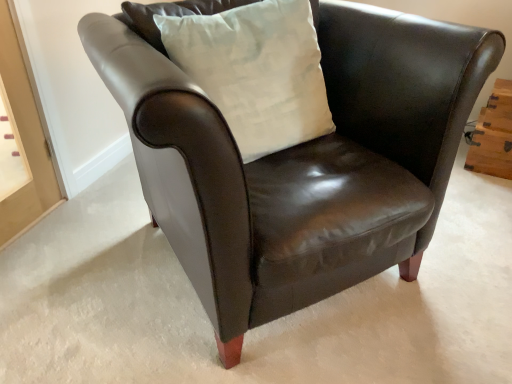
Image resolution: width=512 pixels, height=384 pixels. Identify the location of white cotton pillow at upper center. (256, 71).

What is the approximate height of white cotton pillow at upper center?

white cotton pillow at upper center is 19.49 inches in height.

The image size is (512, 384). Describe the element at coordinates (256, 71) in the screenshot. I see `white cotton pillow at upper center` at that location.

The height and width of the screenshot is (384, 512). Describe the element at coordinates (493, 135) in the screenshot. I see `wooden drawer at right` at that location.

What is the approximate height of wooden drawer at right?

wooden drawer at right is 24.56 centimeters tall.

Identify the location of wooden drawer at right. The width and height of the screenshot is (512, 384). (493, 135).

Identify the location of white cotton pillow at upper center. (256, 71).

Does wooden drawer at right appear on the left side of white cotton pillow at upper center?

No, wooden drawer at right is not to the left of white cotton pillow at upper center.

Which object is closer to the camera taking this photo, wooden drawer at right or white cotton pillow at upper center?

white cotton pillow at upper center is in front.

Which is less distant, [493,158] or [267,125]?

Point [493,158] is positioned farther from the camera compared to point [267,125].

From the image's perspective, is wooden drawer at right positioned above or below white cotton pillow at upper center?

wooden drawer at right is situated lower than white cotton pillow at upper center in the image.

From a real-world perspective, which is physically below, wooden drawer at right or white cotton pillow at upper center?

In real-world perspective, wooden drawer at right is lower.

Which of these two, wooden drawer at right or white cotton pillow at upper center, is wider?

white cotton pillow at upper center.

Does wooden drawer at right have a lesser height compared to white cotton pillow at upper center?

Yes, wooden drawer at right is shorter than white cotton pillow at upper center.

Can you confirm if wooden drawer at right is bigger than white cotton pillow at upper center?

Actually, wooden drawer at right might be smaller than white cotton pillow at upper center.

Is wooden drawer at right not inside white cotton pillow at upper center?

Absolutely, wooden drawer at right is external to white cotton pillow at upper center.

Are wooden drawer at right and white cotton pillow at upper center located far from each other?

Indeed, wooden drawer at right is not near white cotton pillow at upper center.

Is wooden drawer at right aimed at white cotton pillow at upper center?

No, wooden drawer at right is not facing towards white cotton pillow at upper center.

How many degrees apart are the facing directions of wooden drawer at right and white cotton pillow at upper center?

56.2 degrees.

Identify the location of pillow above the wooden drawer at right (from a real-world perspective). click(x=256, y=71).

Considering the relative positions of white cotton pillow at upper center and wooden drawer at right in the image provided, is white cotton pillow at upper center to the left of wooden drawer at right from the viewer's perspective?

Correct, you'll find white cotton pillow at upper center to the left of wooden drawer at right.

Is white cotton pillow at upper center closer to camera compared to wooden drawer at right?

That is True.

Between point (288, 114) and point (504, 128), which one is positioned in front?

The point (288, 114) is more forward.

From the image's perspective, is white cotton pillow at upper center above wooden drawer at right?

Yes, from the image's perspective, white cotton pillow at upper center is on top of wooden drawer at right.

From a real-world perspective, is white cotton pillow at upper center below wooden drawer at right?

No, from a real-world perspective, white cotton pillow at upper center is not below wooden drawer at right.

Considering the relative sizes of white cotton pillow at upper center and wooden drawer at right in the image provided, is white cotton pillow at upper center wider than wooden drawer at right?

Correct, the width of white cotton pillow at upper center exceeds that of wooden drawer at right.

Is white cotton pillow at upper center shorter than wooden drawer at right?

In fact, white cotton pillow at upper center may be taller than wooden drawer at right.

Which of these two, white cotton pillow at upper center or wooden drawer at right, is smaller?

With smaller size is wooden drawer at right.

Is wooden drawer at right located within white cotton pillow at upper center?

No, wooden drawer at right is located outside of white cotton pillow at upper center.

Is white cotton pillow at upper center far from wooden drawer at right?

Yes, white cotton pillow at upper center is far from wooden drawer at right.

Could you tell me if white cotton pillow at upper center is facing wooden drawer at right?

No, white cotton pillow at upper center is not aimed at wooden drawer at right.

This screenshot has width=512, height=384. I want to click on pillow to the left of wooden drawer at right, so click(256, 71).

Where is `pillow located above the wooden drawer at right (from a real-world perspective)`? This screenshot has width=512, height=384. pillow located above the wooden drawer at right (from a real-world perspective) is located at coordinates (x=256, y=71).

Locate an element on the screen. This screenshot has height=384, width=512. pillow in front of the wooden drawer at right is located at coordinates (256, 71).